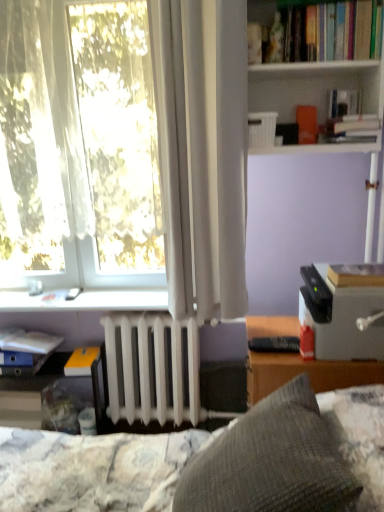
You are a GUI agent. You are given a task and a screenshot of the screen. Output one action in this format:
    pyautogui.click(x=<x>, y=<y>)
    Task: Click on the free space above hardcover book at right, the 2th book from the right (from a real-world perspective)
    This screenshot has height=512, width=384.
    Given the screenshot: What is the action you would take?
    pyautogui.click(x=360, y=269)